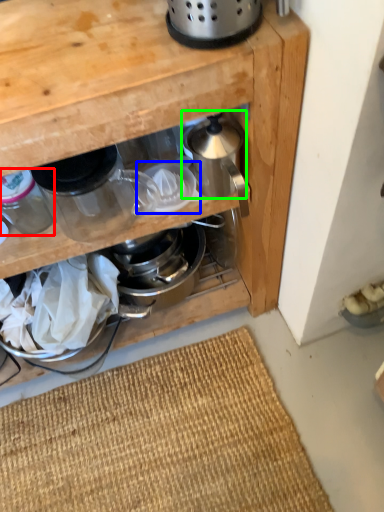
Question: Which object is the closest to the appliance (highlighted by a red box)? Choose among these: appliance (highlighted by a blue box) or appliance (highlighted by a green box).

Choices:
 (A) appliance
 (B) appliance

Answer: (A)